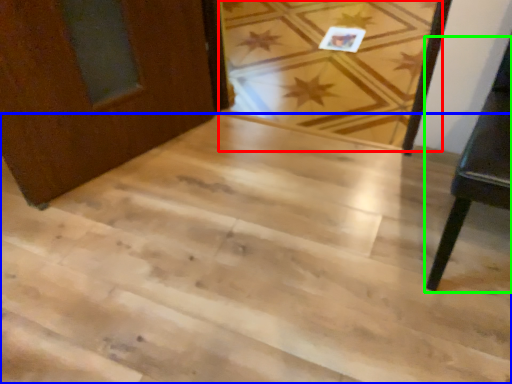
Question: Considering the real-world distances, which object is farthest from plank (highlighted by a red box)? stairwell (highlighted by a blue box) or furniture (highlighted by a green box)?

Choices:
 (A) stairwell
 (B) furniture

Answer: (B)